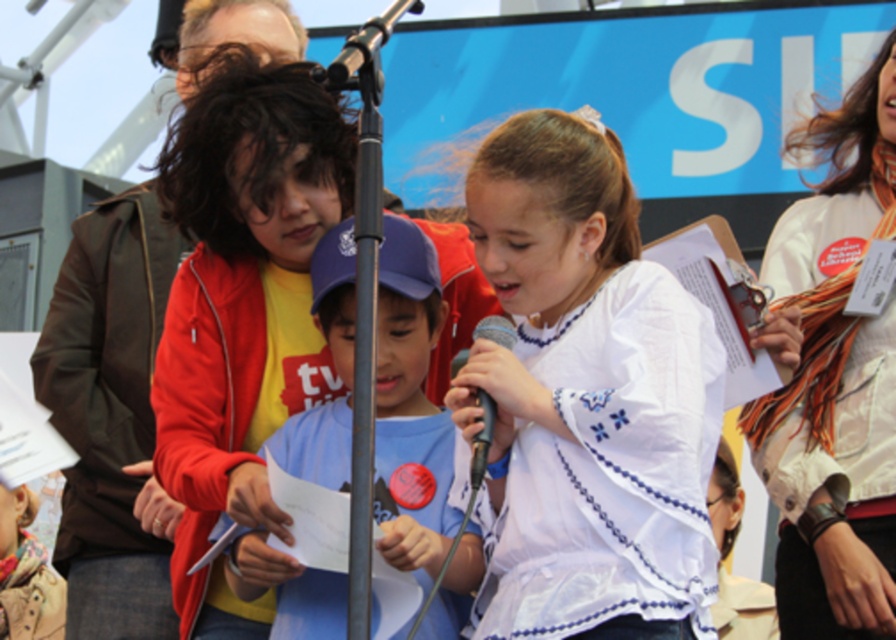
Question: Is white embroidered blouse at center wider than black plastic microphone at center?

Choices:
 (A) yes
 (B) no

Answer: (A)

Question: Is white embroidered blouse at center above black plastic microphone at center?

Choices:
 (A) yes
 (B) no

Answer: (A)

Question: Among these points, which one is nearest to the camera?

Choices:
 (A) (506, 339)
 (B) (867, 216)
 (C) (619, 604)
 (D) (350, 282)

Answer: (C)

Question: Which of the following is the closest to the observer?

Choices:
 (A) (393, 339)
 (B) (501, 337)
 (C) (589, 592)
 (D) (849, 481)

Answer: (C)

Question: Considering the real-world distances, which object is closest to the black plastic microphone at center?

Choices:
 (A) white embroidered blouse at center
 (B) blue cotton shirt at center
 (C) white scarf at upper right

Answer: (A)

Question: Is white scarf at upper right above black plastic microphone at center?

Choices:
 (A) no
 (B) yes

Answer: (B)